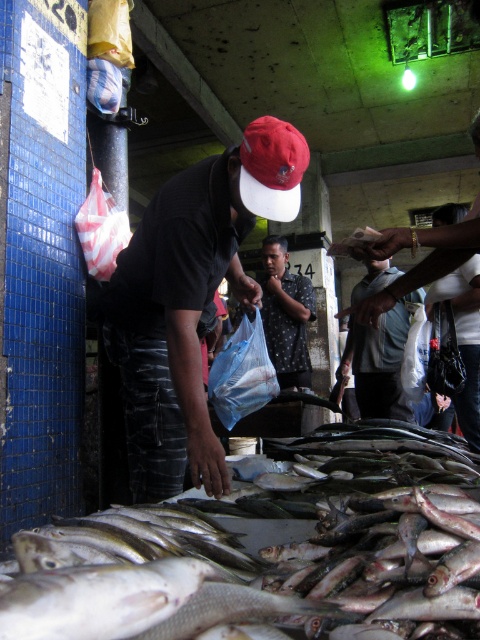
Question: Can you confirm if shiny silver fish at lower center is positioned below matte red baseball cap at center?

Choices:
 (A) yes
 (B) no

Answer: (A)

Question: Estimate the real-world distances between objects in this image. Which object is farther from the matte red baseball cap at center?

Choices:
 (A) dark gray dotted shirt at center
 (B) matte black shirt at center
 (C) light blue fabric shirt at center
 (D) shiny silver fish at lower center

Answer: (C)

Question: Is shiny silver fish at lower center to the left of matte red baseball cap at center from the viewer's perspective?

Choices:
 (A) no
 (B) yes

Answer: (A)

Question: Where is shiny silver fish at lower center located in relation to light blue fabric shirt at center in the image?

Choices:
 (A) left
 (B) right

Answer: (A)

Question: Estimate the real-world distances between objects in this image. Which object is closer to the shiny silver fish at lower center?

Choices:
 (A) dark gray dotted shirt at center
 (B) matte black shirt at center
 (C) matte red baseball cap at center
 (D) light blue fabric shirt at center

Answer: (B)

Question: Which point appears farthest from the camera in this image?

Choices:
 (A) (278, 317)
 (B) (264, 164)
 (C) (433, 456)

Answer: (A)